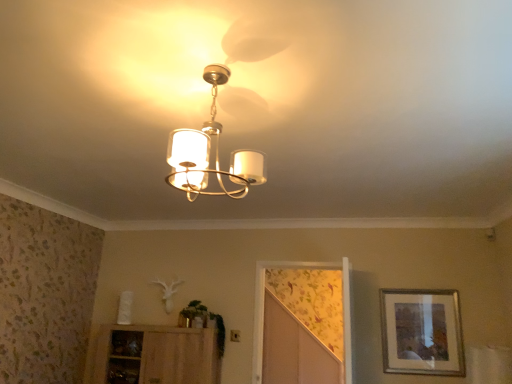
Question: From a real-world perspective, is matte white chandelier at center physically located above or below floral wallpaper screen door at center?

Choices:
 (A) below
 (B) above

Answer: (B)

Question: Does point (231, 162) appear closer or farther from the camera than point (264, 374)?

Choices:
 (A) closer
 (B) farther

Answer: (A)

Question: Estimate the real-world distances between objects in this image. Which object is closer to the silver metallic picture frame at right?

Choices:
 (A) wooden cabinet at lower left
 (B) floral wallpaper screen door at center
 (C) matte white chandelier at center

Answer: (B)

Question: Estimate the real-world distances between objects in this image. Which object is farther from the floral wallpaper screen door at center?

Choices:
 (A) wooden cabinet at lower left
 (B) silver metallic picture frame at right
 (C) matte white chandelier at center

Answer: (C)